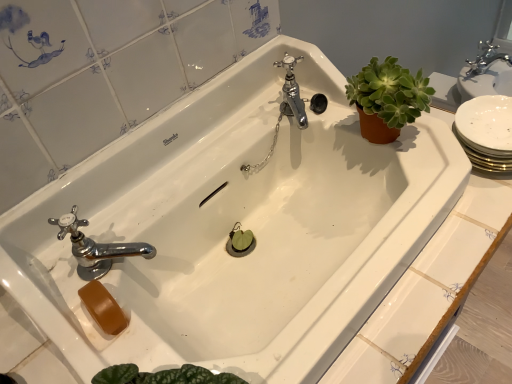
Question: Visually, is chrome metallic faucet at center, the first tap viewed from the back, positioned to the left or to the right of chrome metallic faucet at lower left, which is the second tap from right to left?

Choices:
 (A) left
 (B) right

Answer: (B)

Question: From the image's perspective, relative to chrome metallic faucet at lower left, the 1th tap in the bottom-to-top sequence, is chrome metallic faucet at center, the 1th tap positioned from the top, above or below?

Choices:
 (A) below
 (B) above

Answer: (B)

Question: Considering the real-world distances, which object is closest to the chrome metallic faucet at center, the 1th tap positioned from the top?

Choices:
 (A) green succulent at upper right
 (B) chrome metallic faucet at lower left, which is the first tap in left-to-right order

Answer: (A)

Question: Estimate the real-world distances between objects in this image. Which object is farther from the green succulent at upper right?

Choices:
 (A) chrome metallic faucet at center, the 2th tap positioned from the bottom
 (B) chrome metallic faucet at lower left, which is the second tap from right to left

Answer: (B)